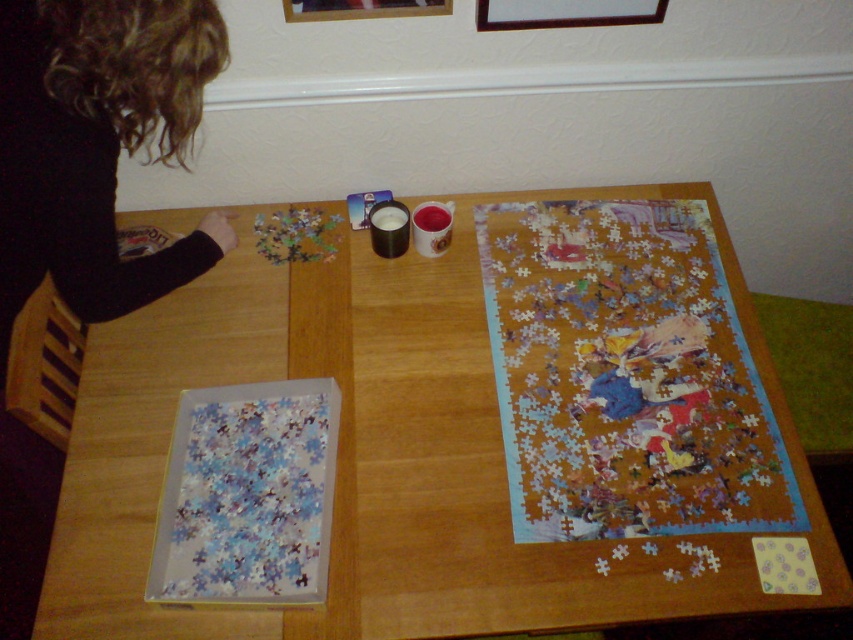
You are a person with a height of 1.7 meters standing at the edge of the table where the puzzle is being worked on. You want to reach the point at coordinates point (x=242, y=380) on the table. Can you safely reach that point without leaning over the table?

The distance of point (x=242, y=380) from the camera is 1.17 meters. Since the person is standing at the edge of the table, they can safely reach the point without leaning over as the distance is within a typical arm reach for a person of 1.7 meters height.

You are a person sitting at the wooden table at center and looking towards the curly hair at upper left. Which object is closer to your eyes?

The curly hair at upper left is closer to your eyes because it is positioned above the wooden table at center, which is lower in height.